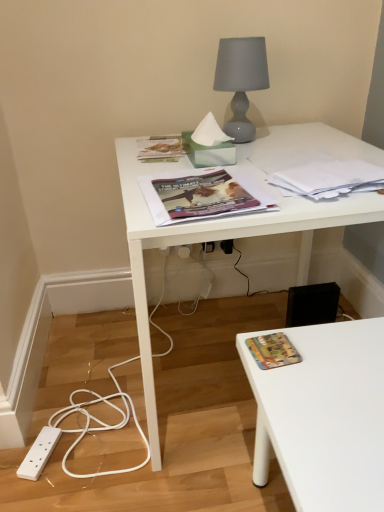
Where is `free space behind white plastic power plugs and sockets at lower left`? The width and height of the screenshot is (384, 512). free space behind white plastic power plugs and sockets at lower left is located at coordinates (65, 406).